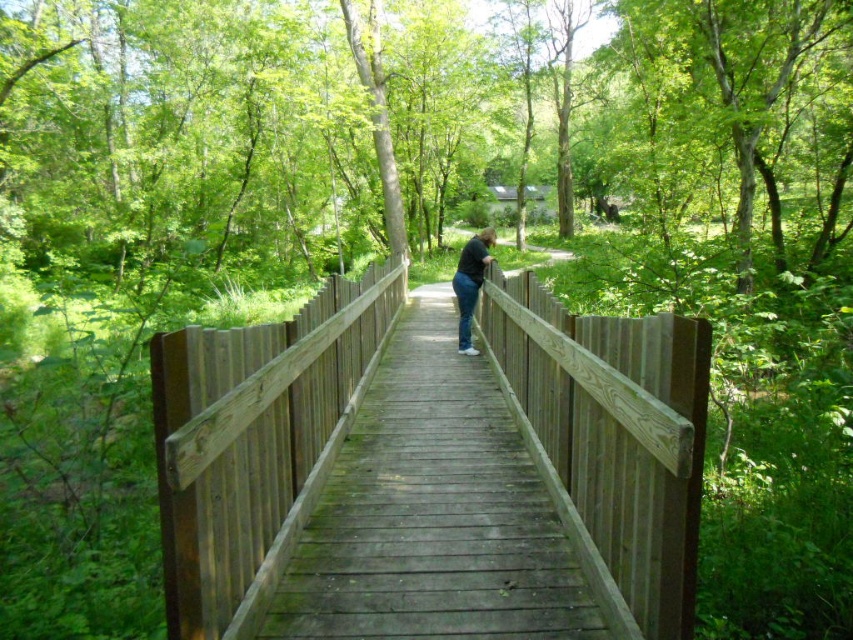
You are standing at the origin point in the forest scene. The wooden bridge at center is marked at coordinates 0.692 on the x and 0.301 on the y. If you want to reach the bridge, which direction should you move relative to your current position?

The wooden bridge at center is located at coordinates 0.692 on the x and 0.301 on the y. To reach it from the origin, you should move northeast since the x coordinate is higher than the origin, indicating eastward direction, and the y coordinate is also higher, suggesting a northern direction. Combining both, the direction is northeast.

You are standing on the wooden bridge and want to take a photo of both the point at coordinates point (605, 568) and point (463, 285). Which point should you focus on first to ensure both are in focus?

You should focus on point (605, 568) first because it is closer to the camera than point (463, 285). This ensures that the closer point is in focus, and the farther point will also be within the depth of field.